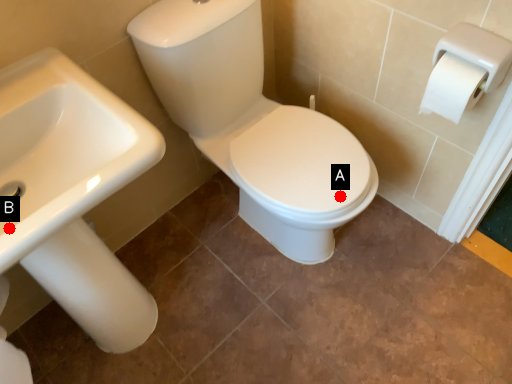
Question: Two points are circled on the image, labeled by A and B beside each circle. Which point is further to the camera?

Choices:
 (A) A is further
 (B) B is further

Answer: (A)